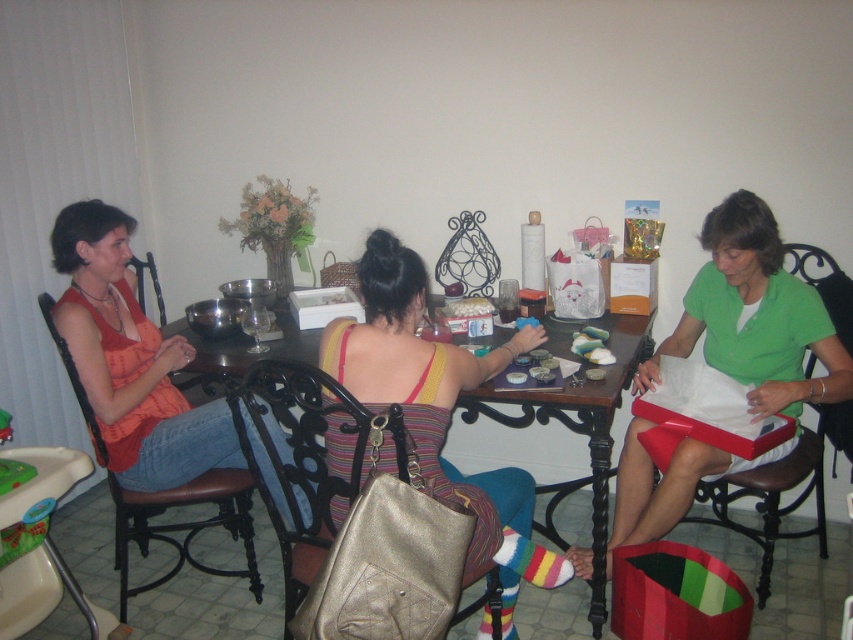
Locate an element on the screen. wooden table at center is located at coordinates (578, 433).

Between wooden table at center and black leather chair at right, which one has more height?

black leather chair at right is taller.

Which is in front, point (289, 346) or point (824, 291)?

Point (824, 291) is in front.

The image size is (853, 640). What are the coordinates of `wooden table at center` in the screenshot? It's located at (578, 433).

Between metallic gold handbag at center and black leather chair at right, which one has less height?

With less height is metallic gold handbag at center.

Who is taller, metallic gold handbag at center or black leather chair at right?

Standing taller between the two is black leather chair at right.

What do you see at coordinates (314, 454) in the screenshot?
I see `metallic gold handbag at center` at bounding box center [314, 454].

Identify the location of metallic gold handbag at center. (314, 454).

This screenshot has width=853, height=640. What do you see at coordinates (165, 500) in the screenshot?
I see `brown leather chair at left` at bounding box center [165, 500].

Image resolution: width=853 pixels, height=640 pixels. I want to click on brown leather chair at left, so click(x=165, y=500).

Is point (254, 570) positioned behind point (811, 284)?

No, it is not.

Image resolution: width=853 pixels, height=640 pixels. Find the location of `brown leather chair at left`. brown leather chair at left is located at coordinates (165, 500).